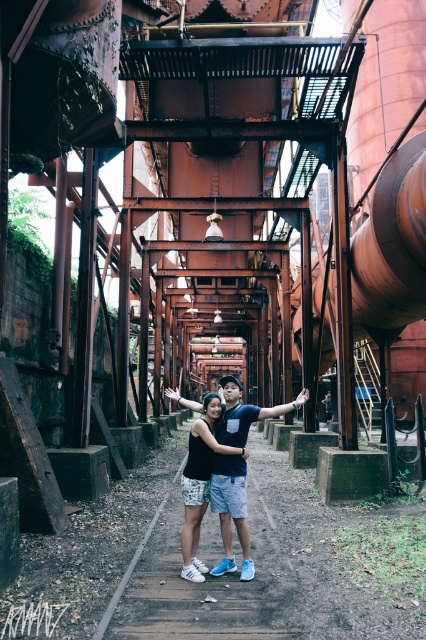
Question: Estimate the real-world distances between objects in this image. Which object is farther from the black matte shirt at center?

Choices:
 (A) matte black tank top at center
 (B) matte black t-shirt at center

Answer: (B)

Question: Is matte black t-shirt at center positioned at the back of matte black tank top at center?

Choices:
 (A) yes
 (B) no

Answer: (A)

Question: In this image, where is matte black t-shirt at center located relative to matte black arm at center?

Choices:
 (A) above
 (B) below

Answer: (B)

Question: Which of the following is the closest to the observer?

Choices:
 (A) (224, 451)
 (B) (270, 410)
 (C) (184, 540)

Answer: (C)

Question: Among these points, which one is nearest to the camera?

Choices:
 (A) (302, 394)
 (B) (235, 488)

Answer: (B)

Question: Does matte black t-shirt at center appear on the left side of black matte shirt at center?

Choices:
 (A) yes
 (B) no

Answer: (B)